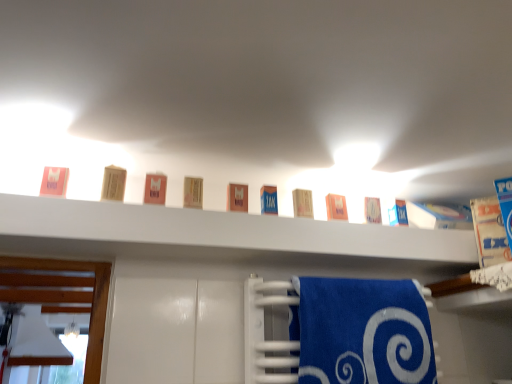
This screenshot has height=384, width=512. I want to click on white matte shelf at upper center, so coord(215,235).

The height and width of the screenshot is (384, 512). Describe the element at coordinates (215, 235) in the screenshot. I see `white matte shelf at upper center` at that location.

This screenshot has width=512, height=384. What do you see at coordinates (273, 362) in the screenshot? I see `blue terry cloth towel at lower center` at bounding box center [273, 362].

Measure the distance between point (274, 297) and camera.

They are 3.49 feet apart.

At what (x,y) coordinates should I click in order to perform the action: click on blue terry cloth towel at lower center. Please return your answer as a coordinate pair (x, y). The image size is (512, 384). Looking at the image, I should click on (273, 362).

The height and width of the screenshot is (384, 512). I want to click on white matte shelf at upper center, so click(215, 235).

Can you confirm if white matte shelf at upper center is positioned to the left of blue terry cloth towel at lower center?

Correct, you'll find white matte shelf at upper center to the left of blue terry cloth towel at lower center.

Between white matte shelf at upper center and blue terry cloth towel at lower center, which one is positioned in front?

Positioned in front is white matte shelf at upper center.

Between point (280, 223) and point (285, 287), which one is positioned in front?

The point (285, 287) is in front.

From the image's perspective, between white matte shelf at upper center and blue terry cloth towel at lower center, which one is located above?

white matte shelf at upper center.

From a real-world perspective, between white matte shelf at upper center and blue terry cloth towel at lower center, who is vertically higher?

In real-world perspective, white matte shelf at upper center is above.

Does white matte shelf at upper center have a lesser width compared to blue terry cloth towel at lower center?

Incorrect, the width of white matte shelf at upper center is not less than that of blue terry cloth towel at lower center.

Can you confirm if white matte shelf at upper center is shorter than blue terry cloth towel at lower center?

Yes, white matte shelf at upper center is shorter than blue terry cloth towel at lower center.

Is white matte shelf at upper center bigger than blue terry cloth towel at lower center?

Indeed, white matte shelf at upper center has a larger size compared to blue terry cloth towel at lower center.

Would you say white matte shelf at upper center contains blue terry cloth towel at lower center?

No.

Looking at this image, can you see white matte shelf at upper center touching blue terry cloth towel at lower center?

No, white matte shelf at upper center is not beside blue terry cloth towel at lower center.

Could you tell me if white matte shelf at upper center is facing blue terry cloth towel at lower center?

No, white matte shelf at upper center is not turned towards blue terry cloth towel at lower center.

What's the angular difference between white matte shelf at upper center and blue terry cloth towel at lower center's facing directions?

white matte shelf at upper center and blue terry cloth towel at lower center are facing 1.33 degrees away from each other.

What are the coordinates of `shelf located above the blue terry cloth towel at lower center (from a real-world perspective)` in the screenshot? It's located at (215, 235).

Between blue terry cloth towel at lower center and white matte shelf at upper center, which one appears on the left side from the viewer's perspective?

Positioned to the left is white matte shelf at upper center.

Which object is closer to the camera taking this photo, blue terry cloth towel at lower center or white matte shelf at upper center?

white matte shelf at upper center is more forward.

Which point is more distant from viewer, (269,361) or (283,250)?

The point (283,250) is farther.

From the picture: From the image's perspective, is blue terry cloth towel at lower center below white matte shelf at upper center?

Correct, blue terry cloth towel at lower center appears lower than white matte shelf at upper center in the image.

From a real-world perspective, is blue terry cloth towel at lower center positioned above or below white matte shelf at upper center?

From a real-world perspective, blue terry cloth towel at lower center is physically below white matte shelf at upper center.

Does blue terry cloth towel at lower center have a greater width compared to white matte shelf at upper center?

No.

Considering the sizes of objects blue terry cloth towel at lower center and white matte shelf at upper center in the image provided, who is taller, blue terry cloth towel at lower center or white matte shelf at upper center?

Standing taller between the two is blue terry cloth towel at lower center.

In terms of size, does blue terry cloth towel at lower center appear bigger or smaller than white matte shelf at upper center?

blue terry cloth towel at lower center is smaller than white matte shelf at upper center.

Consider the image. Do you think blue terry cloth towel at lower center is within white matte shelf at upper center, or outside of it?

blue terry cloth towel at lower center lies outside white matte shelf at upper center.

Would you consider blue terry cloth towel at lower center to be distant from white matte shelf at upper center?

No, blue terry cloth towel at lower center is not far away from white matte shelf at upper center.

Could you tell me if blue terry cloth towel at lower center is turned towards white matte shelf at upper center?

No, blue terry cloth towel at lower center is not turned towards white matte shelf at upper center.

Find the location of a particular element. bath towel lying below the white matte shelf at upper center (from the image's perspective) is located at coordinates (273, 362).

In order to click on bath towel that appears below the white matte shelf at upper center (from a real-world perspective) in this screenshot , I will do `click(273, 362)`.

The height and width of the screenshot is (384, 512). I want to click on bath towel behind the white matte shelf at upper center, so click(x=273, y=362).